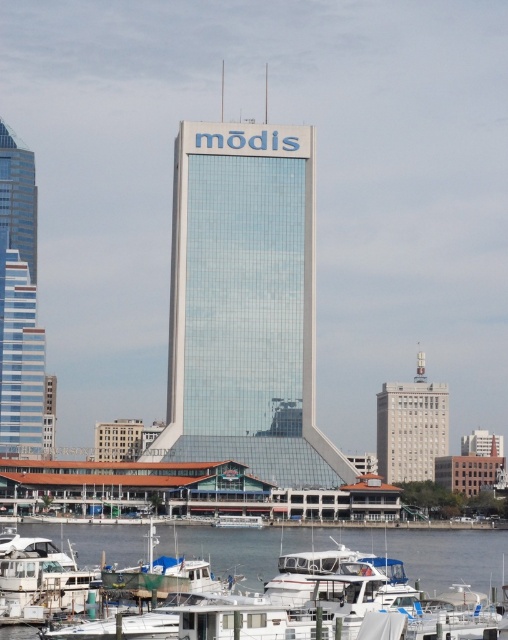
Question: Observing the image, what is the correct spatial positioning of glassy steel skyscraper at left in reference to green tarpaulin boat at lower center?

Choices:
 (A) right
 (B) left

Answer: (B)

Question: Which of the following is the closest to the observer?

Choices:
 (A) gray concrete building at center
 (B) green tarpaulin boat at lower center
 (C) white glossy boat at lower center
 (D) transparent glass tower at center

Answer: (C)

Question: Among these points, which one is farthest from the camera?

Choices:
 (A) (262, 531)
 (B) (4, 349)
 (C) (423, 460)
 (D) (241, 412)

Answer: (C)

Question: Is gray concrete building at center in front of green tarpaulin boat at lower center?

Choices:
 (A) no
 (B) yes

Answer: (A)

Question: Can you confirm if white glossy boat at lower center is thinner than glassy steel skyscraper at left?

Choices:
 (A) no
 (B) yes

Answer: (A)

Question: Considering the real-world distances, which object is farthest from the gray concrete building at center?

Choices:
 (A) white glossy boat at lower center
 (B) green tarpaulin boat at lower center
 (C) glassy steel skyscraper at left

Answer: (B)